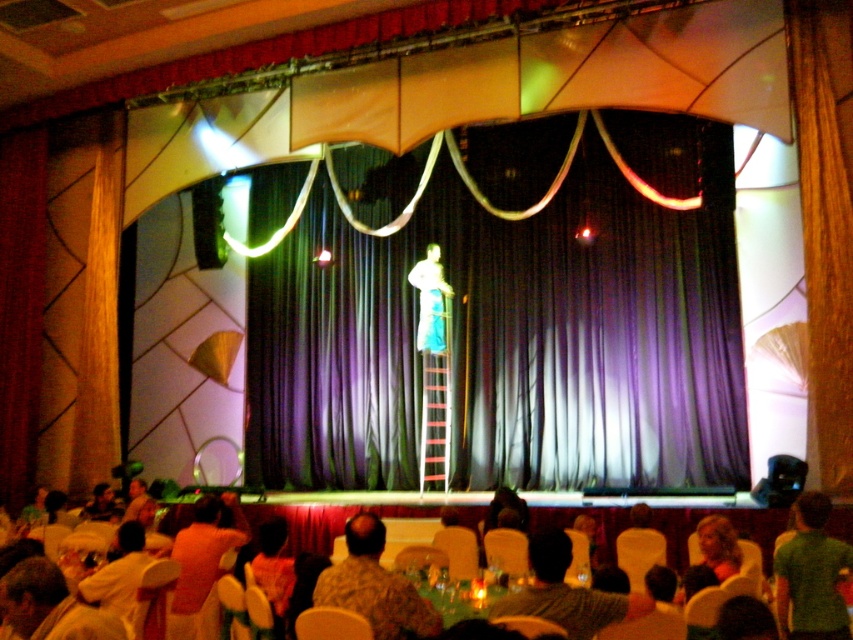
You are a stagehand preparing to adjust the purple fabric curtain at center and the orange fabric shirt at lower left. Which object requires more fabric to make?

The orange fabric shirt at lower left requires more fabric to make because it is thicker than the purple fabric curtain at center.